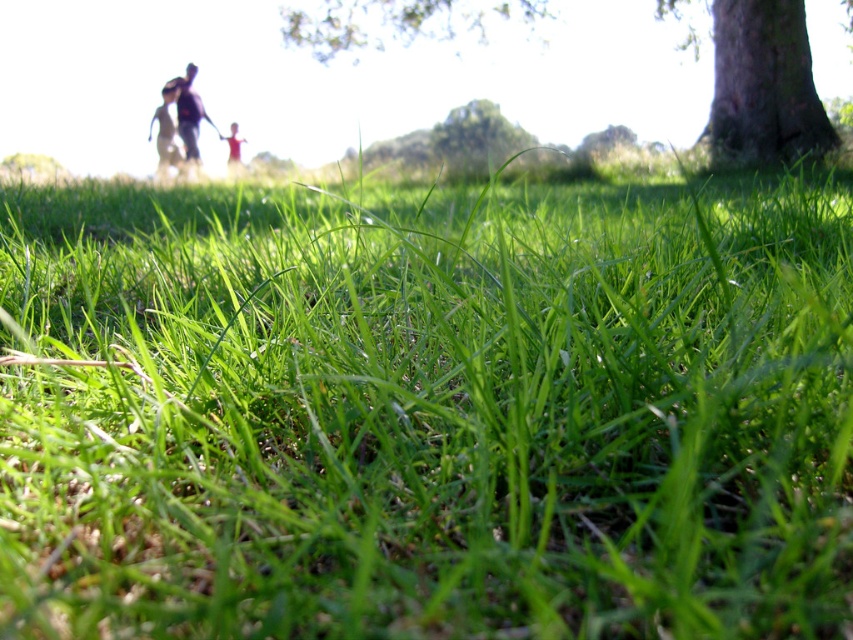
Does smooth bark tree at upper right appear on the left side of green rough bark tree at right?

Indeed, smooth bark tree at upper right is positioned on the left side of green rough bark tree at right.

Is point (489, 12) positioned before point (741, 129)?

That is False.

Identify the location of smooth bark tree at upper right. This screenshot has height=640, width=853. (753, 76).

Is green rough bark tree at right to the left of blurred pink dress at center from the viewer's perspective?

Incorrect, green rough bark tree at right is not on the left side of blurred pink dress at center.

Is point (709, 138) positioned behind point (234, 131)?

No, it is not.

Does point (776, 136) come closer to viewer compared to point (231, 150)?

Yes, it is.

Find the location of a particular element. This screenshot has height=640, width=853. green rough bark tree at right is located at coordinates (763, 84).

Can you confirm if green rough bark tree at right is smaller than dark blue shirt at upper center?

No.

Does green rough bark tree at right appear over dark blue shirt at upper center?

Correct, green rough bark tree at right is located above dark blue shirt at upper center.

Describe the element at coordinates (763, 84) in the screenshot. I see `green rough bark tree at right` at that location.

At what (x,y) coordinates should I click in order to perform the action: click on green rough bark tree at right. Please return your answer as a coordinate pair (x, y). This screenshot has height=640, width=853. Looking at the image, I should click on (763, 84).